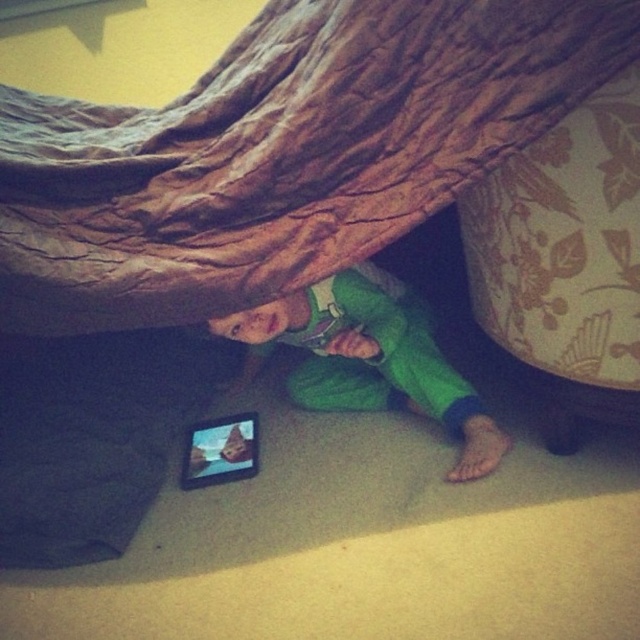
From the picture: You are a parent trying to locate your child who is hiding under the brown textured blanket at upper center. You notice the green fleece pants at lower center sticking out. Considering the height of the blanket, can you safely reach under to check on them without disturbing the structure?

The brown textured blanket at upper center is much taller than the green fleece pants at lower center, so yes, you can safely reach under to check on them without disturbing the structure.

You are a parent looking for your child who is hiding under a blanket. You see the brown textured blanket at upper center and the green fleece pants at lower center. Which object is closer to the left side of the image?

The brown textured blanket at upper center is closer to the left side of the image because it is positioned to the left of the green fleece pants at lower center.

You are a parent trying to find your child who is playing hide and seek. You see the brown textured blanket at upper center and the matte black tablet at lower center. Which object is wider and can help you locate the child?

The brown textured blanket at upper center is wider than the matte black tablet at lower center, so the blanket can help you locate the child as it is covering more area where the child might be hiding.